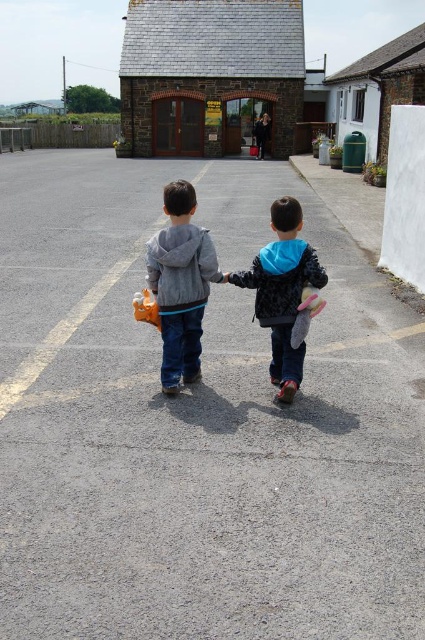
Is point (172, 321) more distant than point (277, 355)?

No.

In order to click on gray fleece hoodie at center in this screenshot , I will do `click(181, 284)`.

Which of these two, gray fleece hoodie at center or orange rubber duck at center, stands taller?

gray fleece hoodie at center is taller.

Does gray fleece hoodie at center have a greater width compared to orange rubber duck at center?

Correct, the width of gray fleece hoodie at center exceeds that of orange rubber duck at center.

Locate an element on the screen. This screenshot has height=640, width=425. gray fleece hoodie at center is located at coordinates (181, 284).

Locate an element on the screen. gray fleece hoodie at center is located at coordinates (181, 284).

From the picture: Is gray fleece hoodie at center to the left of pink fabric toy at center from the viewer's perspective?

Correct, you'll find gray fleece hoodie at center to the left of pink fabric toy at center.

Does gray fleece hoodie at center have a lesser height compared to pink fabric toy at center?

No.

Between point (195, 332) and point (308, 321), which one is positioned behind?

The point (195, 332) is more distant.

What are the coordinates of `gray fleece hoodie at center` in the screenshot? It's located at (181, 284).